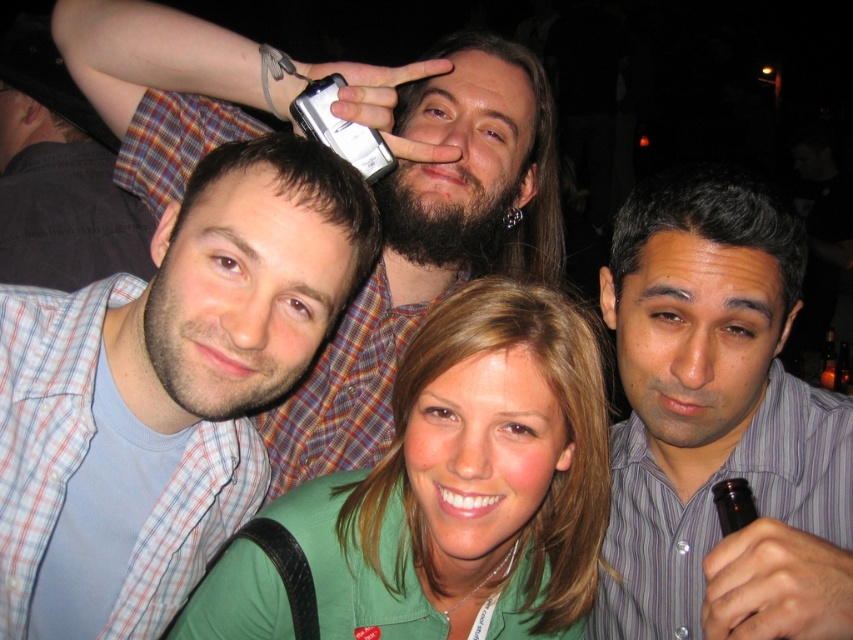
You are standing in the center of the room and want to hand a gift to the person wearing the matte blue shirt at center. Since you can only move forward or backward, can you reach them based on their position coordinates?

The matte blue shirt at center is positioned at coordinates point (165, 388), which means they are located in front of you. Since you can only move forward or backward, you can move forward to reach them.

Based on the photo, you are a photographer trying to capture a group photo. You notice the matte blue shirt at center and the plaid shirt at upper left are 1.26 meters apart. If your camera has a minimum focus distance of 1.5 meters, will you be able to focus on both subjects simultaneously?

The matte blue shirt at center and the plaid shirt at upper left are 1.26 meters apart, which is less than the camera minimum focus distance of 1.5 meters. Therefore, the camera can focus on both subjects simultaneously.